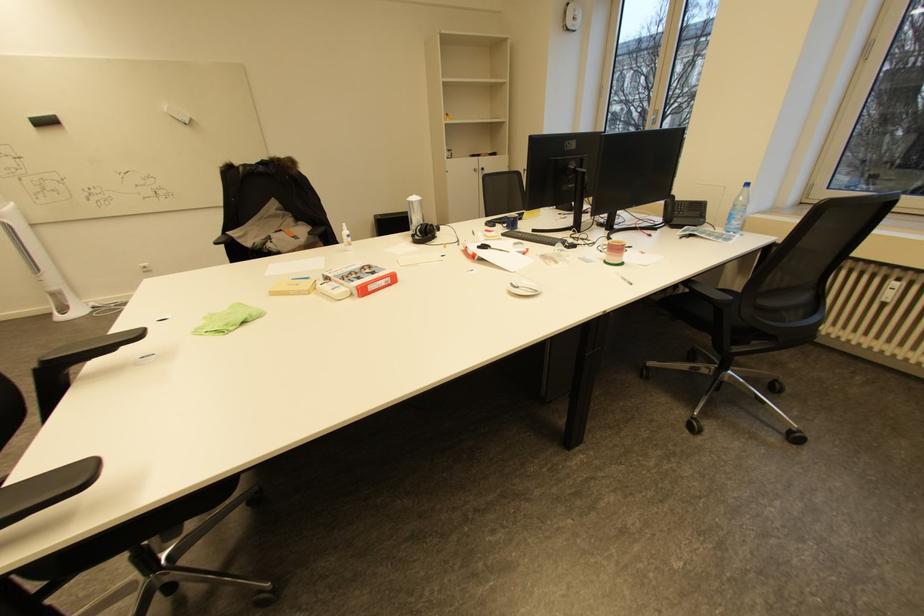
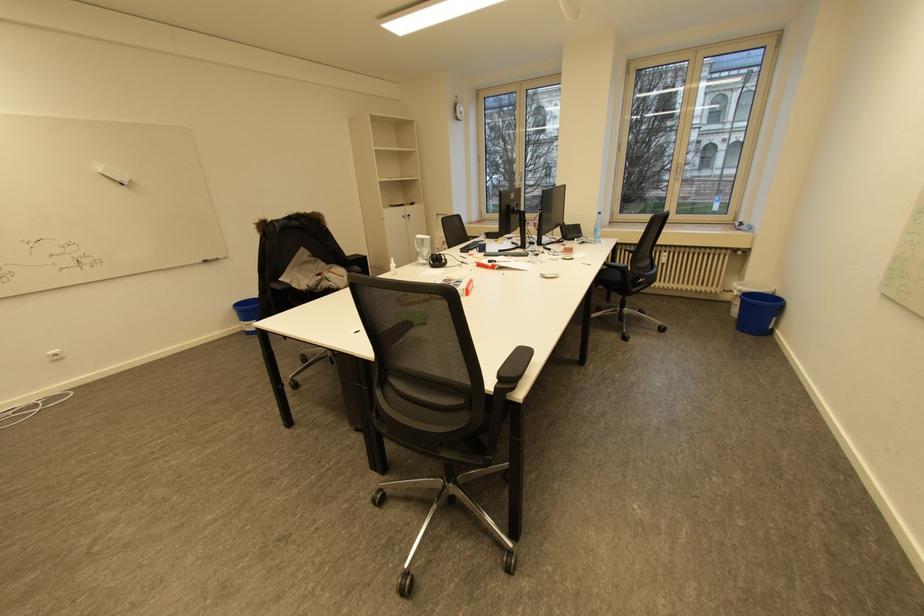
Locate, in the second image, the point that corresponds to (x=487, y=168) in the first image.

(412, 215)